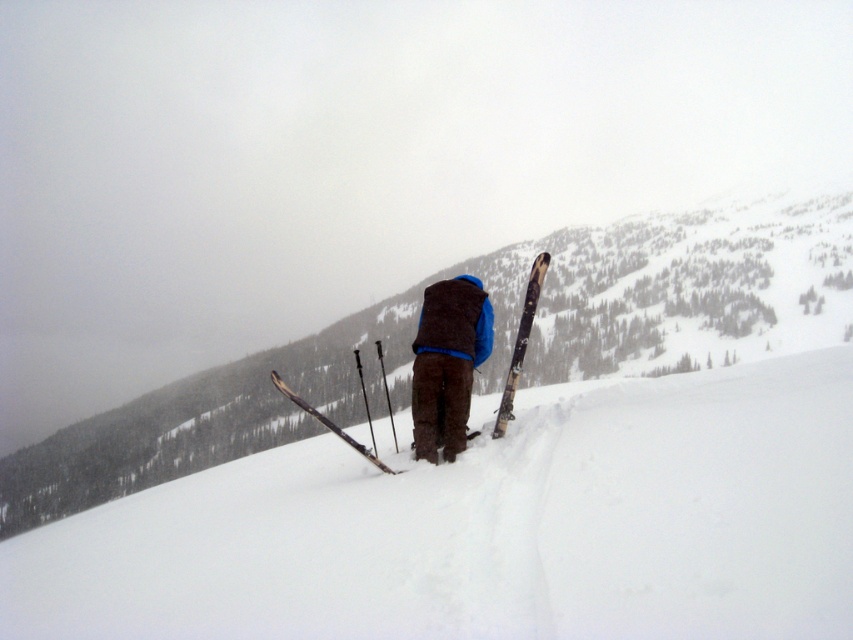
You are a photographer planning to take a portrait of the person in the scene. You want to ensure that both the dark brown fleece vest at center and the wooden ski at center are clearly visible in the frame. Which object should you focus on to ensure both are in focus, considering their sizes?

The dark brown fleece vest at center has a lesser width compared to the wooden ski at center, so focusing on the wooden ski at center will ensure both objects are in focus since it is larger and occupies more space in the frame.

You are a hiker planning to place a small marker at point [456,321] in the snowy landscape. According to the image, what object is exactly at that point?

The dark brown fleece vest at center is located at point [456,321], so the object exactly at that point is the dark brown fleece vest at center.

You are standing at the point labeled point [44,625] and want to walk to the point labeled point [509,397]. Which direction should you move relative to your current position?

Since point [44,625] is closer to the camera than point [509,397], you should move away from the camera to reach the destination.